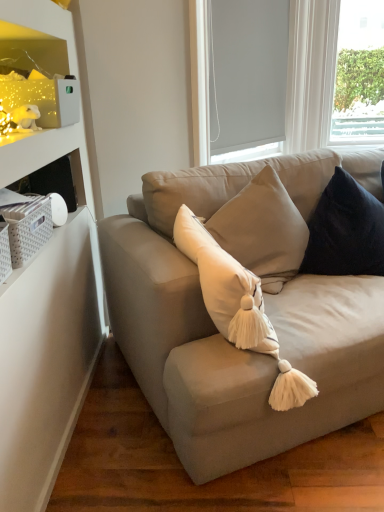
Question: In terms of height, does matte white shelf at upper left look taller or shorter compared to white roller blind at upper center?

Choices:
 (A) short
 (B) tall

Answer: (A)

Question: Considering their positions, is matte white shelf at upper left located in front of or behind white roller blind at upper center?

Choices:
 (A) behind
 (B) front

Answer: (B)

Question: Considering the real-world distances, which object is closest to the matte white shelf at upper left?

Choices:
 (A) suede beige couch at center
 (B) white roller blind at upper center
 (C) velvet dark blue pillow at upper right
 (D) white matte window screen at upper right

Answer: (A)

Question: Which object is positioned closest to the white matte window screen at upper right?

Choices:
 (A) velvet dark blue pillow at upper right
 (B) white roller blind at upper center
 (C) suede beige couch at center
 (D) matte white shelf at upper left

Answer: (B)